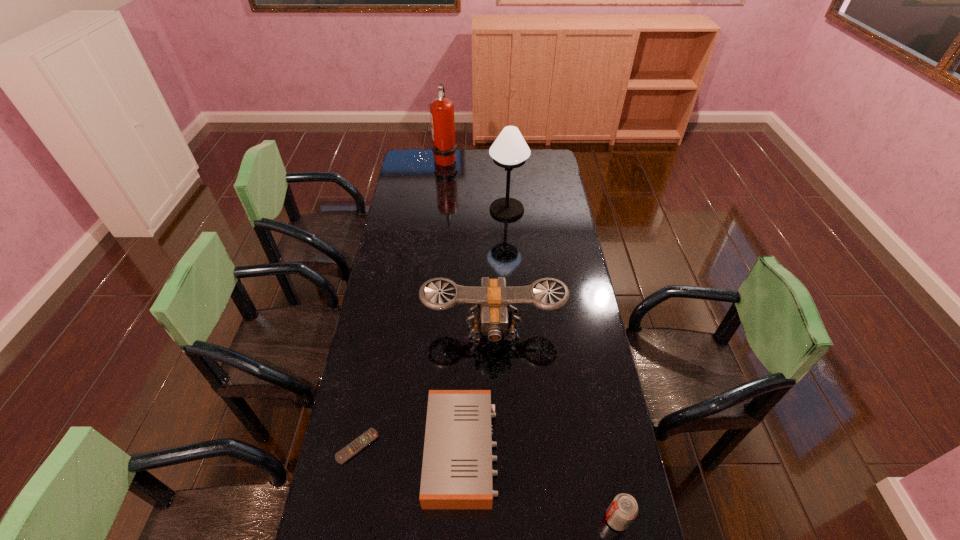
Select which object appears as the fifth closest to the second farthest object. Please provide its 2D coordinates. Your answer should be formatted as a tuple, i.e. [(x, y)], where the tuple contains the x and y coordinates of a point satisfying the conditions above.

[(622, 511)]

Find the location of `vacant space that satisfies the following two spatial constraints: 1. on the front-facing side of the fourth shortest object; 2. on the control panel of the second shortest object`. vacant space that satisfies the following two spatial constraints: 1. on the front-facing side of the fourth shortest object; 2. on the control panel of the second shortest object is located at coordinates (496, 451).

I want to click on free location that satisfies the following two spatial constraints: 1. on the front-facing side of the drone; 2. on the left side of the rightmost object, so click(x=498, y=519).

Where is `vacant area that satisfies the following two spatial constraints: 1. on the front-facing side of the rightmost object; 2. on the left side of the fourth nearest object`? This screenshot has width=960, height=540. vacant area that satisfies the following two spatial constraints: 1. on the front-facing side of the rightmost object; 2. on the left side of the fourth nearest object is located at coordinates (498, 519).

Identify the location of vacant area in the image that satisfies the following two spatial constraints: 1. on the front-facing side of the third farthest object; 2. on the control panel of the fifth tallest object. (496, 451).

Where is `free point that satisfies the following two spatial constraints: 1. at the nozzle of the soda can; 2. on the right side of the fire extinguisher`? Image resolution: width=960 pixels, height=540 pixels. free point that satisfies the following two spatial constraints: 1. at the nozzle of the soda can; 2. on the right side of the fire extinguisher is located at coordinates (409, 519).

Locate an element on the screen. This screenshot has height=540, width=960. free spot that satisfies the following two spatial constraints: 1. on the control panel of the radio receiver; 2. on the back side of the rightmost object is located at coordinates (460, 519).

This screenshot has width=960, height=540. I want to click on blank area in the image that satisfies the following two spatial constraints: 1. on the front-facing side of the third farthest object; 2. on the control panel of the second shortest object, so click(496, 451).